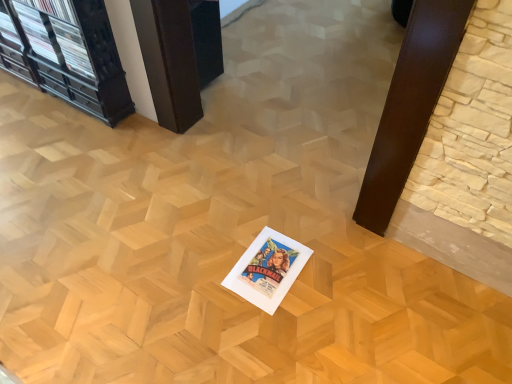
Locate an element on the screen. The width and height of the screenshot is (512, 384). free area below white paper at center (from a real-world perspective) is located at coordinates (268, 271).